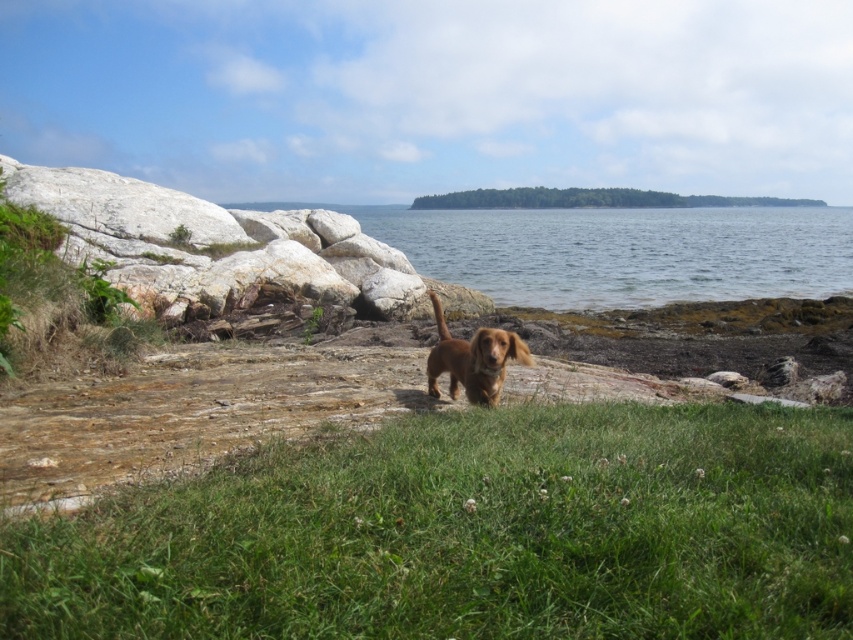
Question: Does green grassy at center have a larger size compared to clear water at center?

Choices:
 (A) yes
 (B) no

Answer: (B)

Question: Estimate the real-world distances between objects in this image. Which object is closer to the green grassy at center?

Choices:
 (A) golden brown fur dog at center
 (B) clear water at center

Answer: (A)

Question: Does green grassy at center have a smaller size compared to clear water at center?

Choices:
 (A) no
 (B) yes

Answer: (B)

Question: Is green grassy at center smaller than golden brown fur dog at center?

Choices:
 (A) yes
 (B) no

Answer: (B)

Question: Estimate the real-world distances between objects in this image. Which object is closer to the clear water at center?

Choices:
 (A) green grassy at center
 (B) golden brown fur dog at center

Answer: (A)

Question: Which point is closer to the camera taking this photo?

Choices:
 (A) (x=457, y=216)
 (B) (x=428, y=365)

Answer: (B)